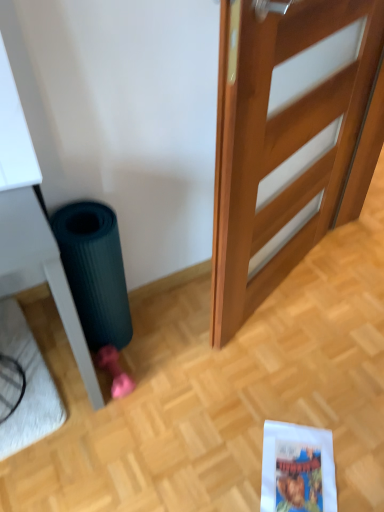
Question: Does white plush doormat at lower left touch wooden door at center?

Choices:
 (A) yes
 (B) no

Answer: (B)

Question: Are white plush doormat at lower left and wooden door at center located far from each other?

Choices:
 (A) yes
 (B) no

Answer: (A)

Question: Is white plush doormat at lower left turned away from wooden door at center?

Choices:
 (A) yes
 (B) no

Answer: (B)

Question: From the image's perspective, is white plush doormat at lower left under wooden door at center?

Choices:
 (A) yes
 (B) no

Answer: (A)

Question: Could you tell me if white plush doormat at lower left is turned towards wooden door at center?

Choices:
 (A) no
 (B) yes

Answer: (A)

Question: Considering the relative sizes of white plush doormat at lower left and wooden door at center in the image provided, is white plush doormat at lower left smaller than wooden door at center?

Choices:
 (A) yes
 (B) no

Answer: (A)

Question: From the image's perspective, does wooden door at center appear lower than white plush doormat at lower left?

Choices:
 (A) no
 (B) yes

Answer: (A)

Question: Is wooden door at center not within white plush doormat at lower left?

Choices:
 (A) yes
 (B) no

Answer: (A)

Question: Is wooden door at center far away from white plush doormat at lower left?

Choices:
 (A) yes
 (B) no

Answer: (A)

Question: Can you confirm if wooden door at center is taller than white plush doormat at lower left?

Choices:
 (A) no
 (B) yes

Answer: (B)

Question: Is white plush doormat at lower left surrounded by wooden door at center?

Choices:
 (A) yes
 (B) no

Answer: (B)

Question: Is wooden door at center shorter than white plush doormat at lower left?

Choices:
 (A) yes
 (B) no

Answer: (B)

Question: Does wooden door at center come in front of dark green rubber mat at lower left?

Choices:
 (A) yes
 (B) no

Answer: (A)